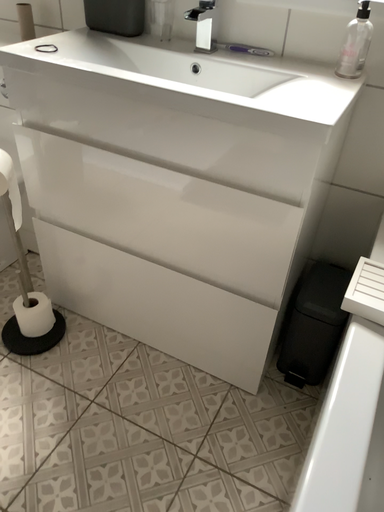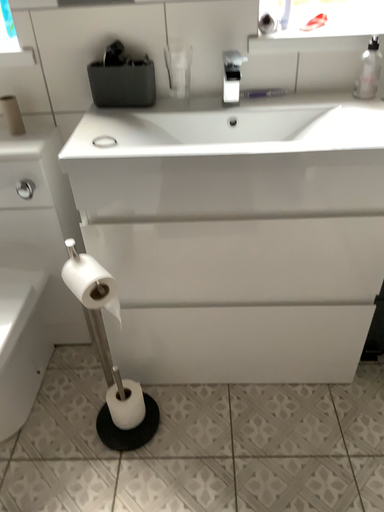
Question: How did the camera likely rotate when shooting the video?

Choices:
 (A) rotated left
 (B) rotated right

Answer: (B)